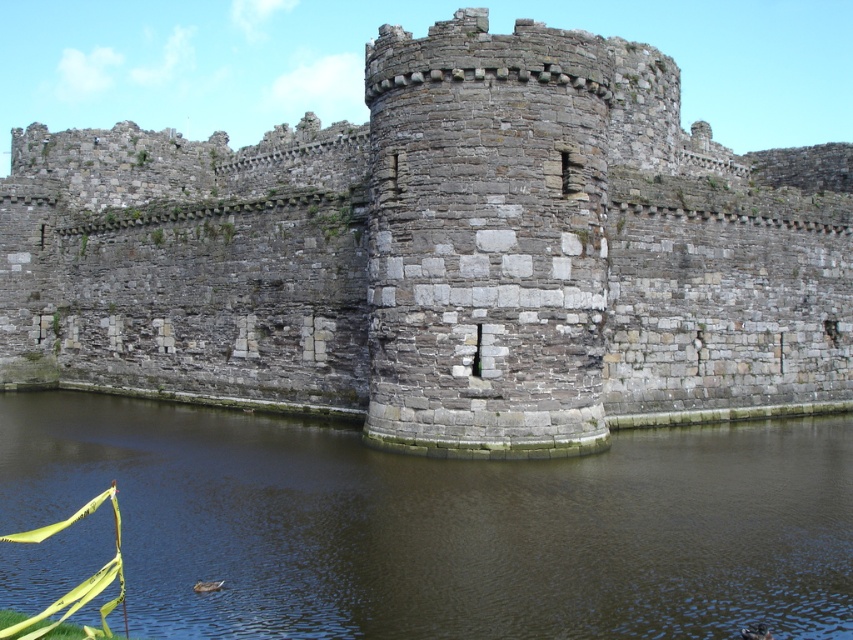
Is point (627, 184) positioned behind point (398, 529)?

Yes, it is.

Is gray stone wall at center thinner than brown stone water at center?

No.

Does point (495, 400) come closer to viewer compared to point (701, 547)?

No, (495, 400) is behind (701, 547).

Find the location of a particular element. This screenshot has width=853, height=640. gray stone wall at center is located at coordinates tap(444, 253).